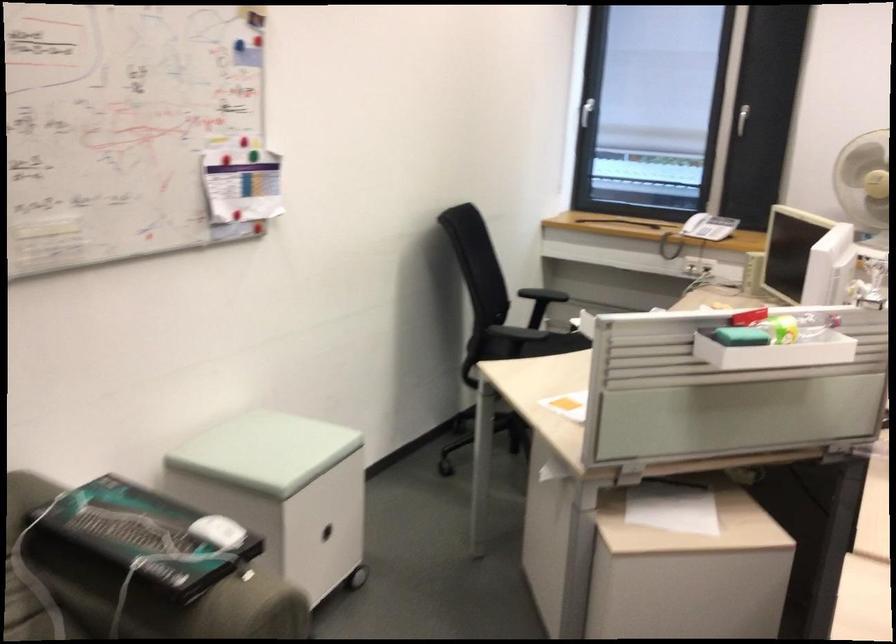
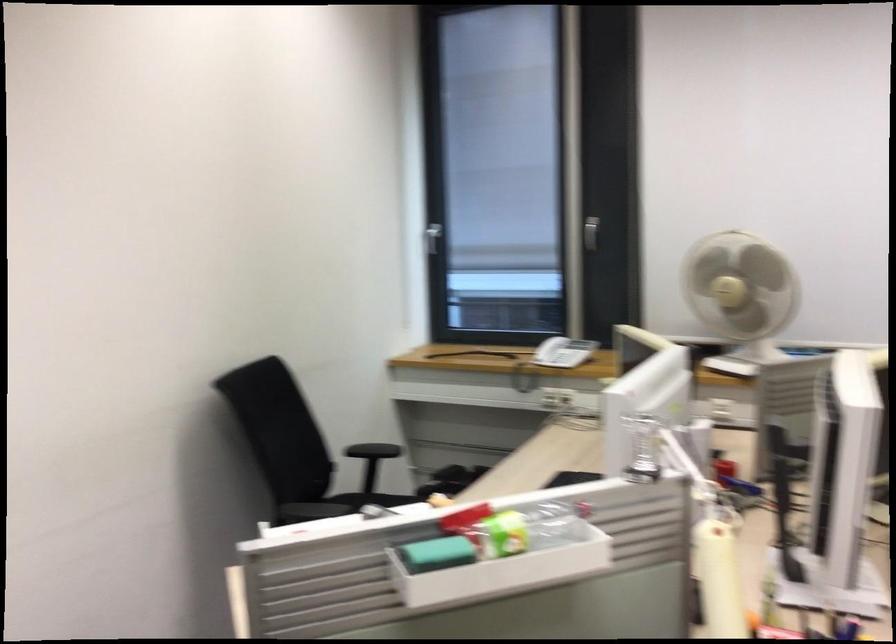
Question: The first image is from the beginning of the video and the second image is from the end. How did the camera likely rotate when shooting the video?

Choices:
 (A) Left
 (B) Right
 (C) Up
 (D) Down

Answer: (C)